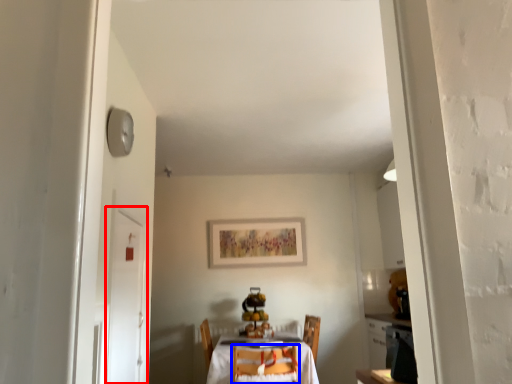
Question: Which of the following is the closest to the observer, door (highlighted by a red box) or chair (highlighted by a blue box)?

Choices:
 (A) door
 (B) chair

Answer: (A)